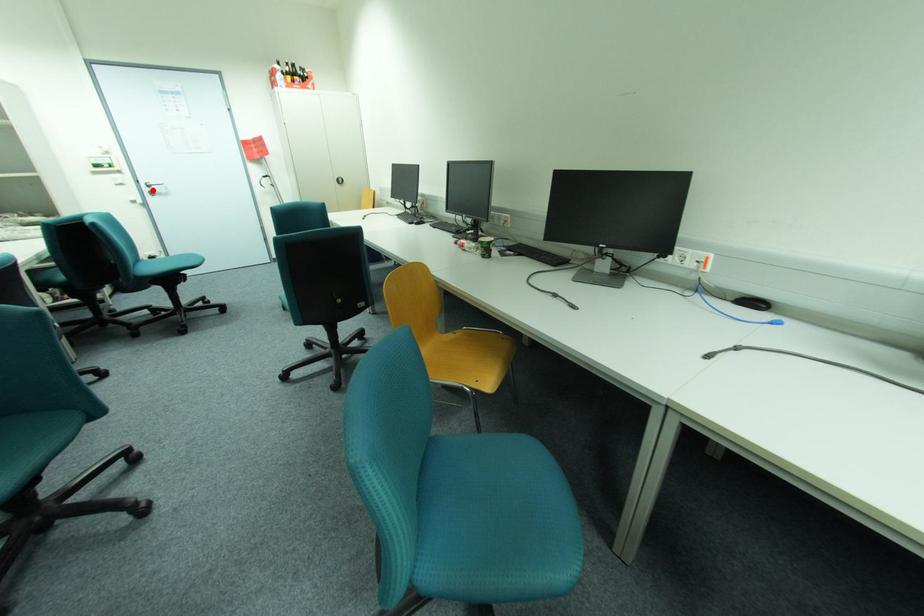
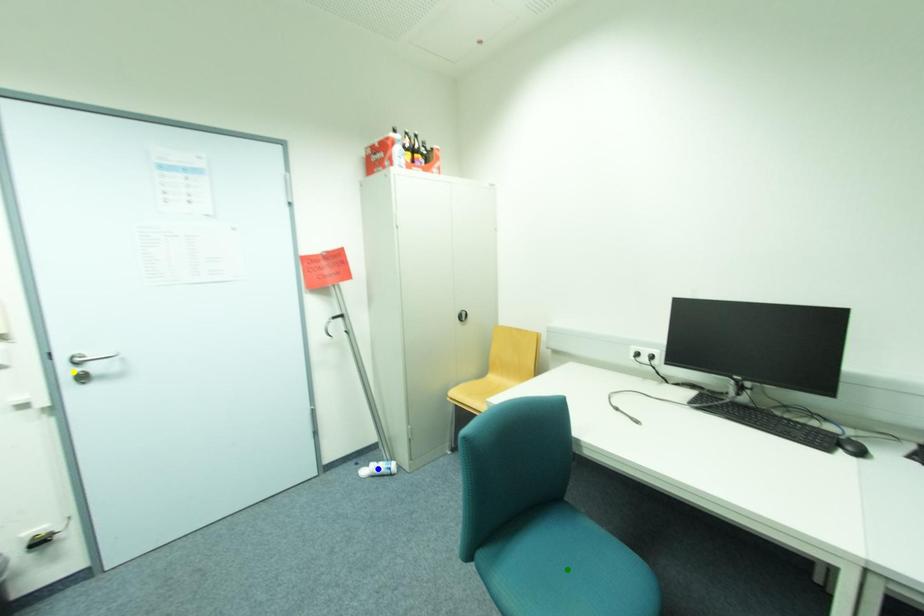
Question: I am providing you with two images of the same scene from different viewpoints. A red point is marked on the first image. You are given multiple points on the second image. Which spot in image 2 lines up with the point in image 1?

Choices:
 (A) yellow point
 (B) blue point
 (C) green point

Answer: (A)